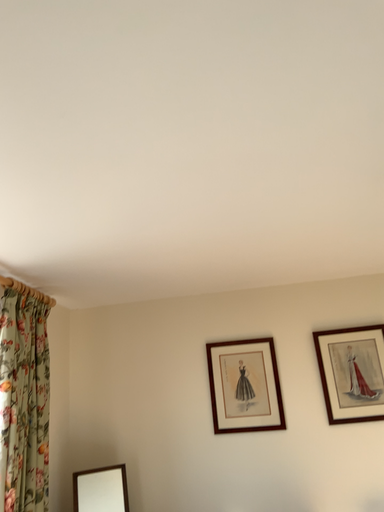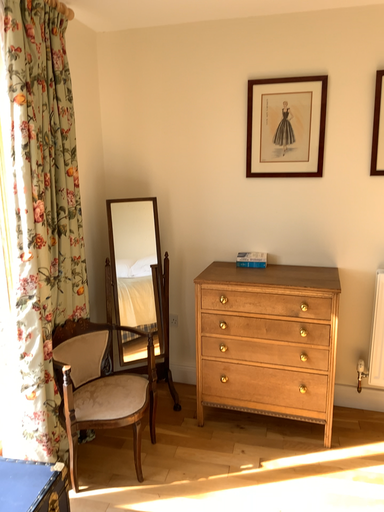
Question: Which way did the camera rotate in the video?

Choices:
 (A) rotated left
 (B) rotated right

Answer: (A)